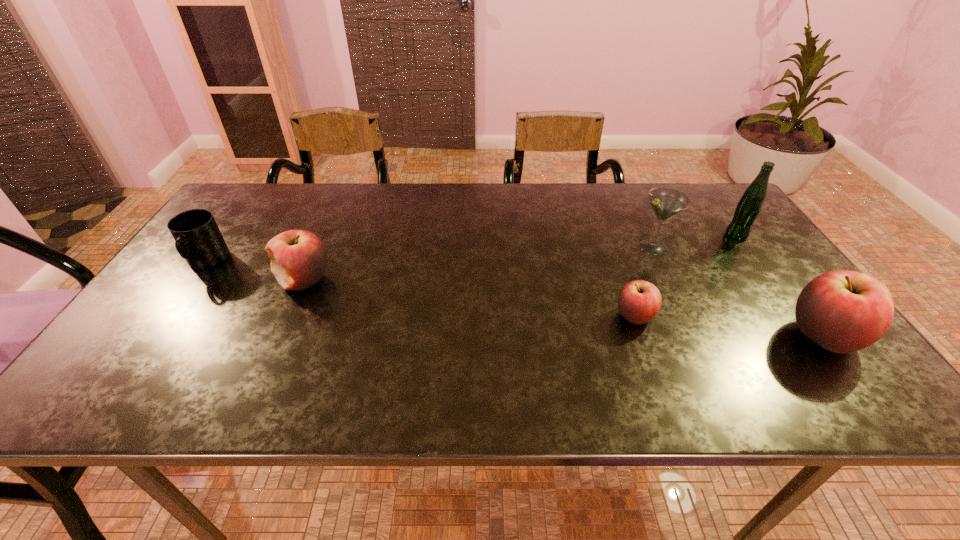
To make them evenly spaced by inserting another apple among them, please locate a vacant spot for this new apple. Please provide its 2D coordinates. Your answer should be formatted as a tuple, i.e. [(x, y)], where the tuple contains the x and y coordinates of a point satisfying the conditions above.

[(462, 298)]